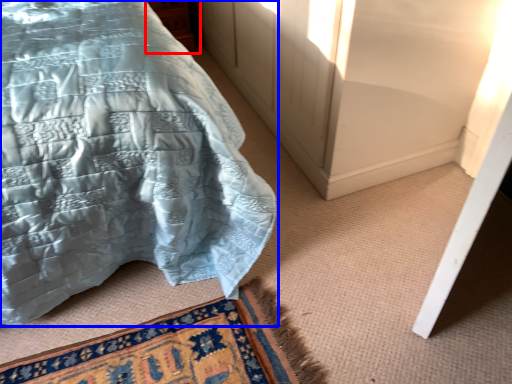
Question: Among these objects, which one is nearest to the camera, cabinetry (highlighted by a red box) or bed (highlighted by a blue box)?

Choices:
 (A) cabinetry
 (B) bed

Answer: (B)